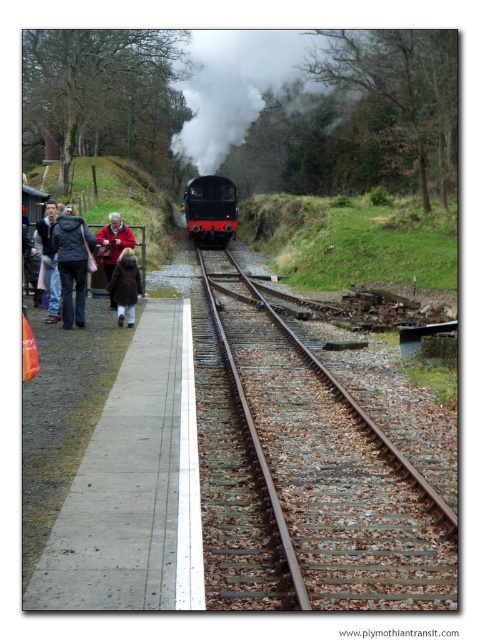
Question: Estimate the real-world distances between objects in this image. Which object is closer to the white smoke at center?

Choices:
 (A) brown woolen coat at left
 (B) dark gray jacket at left
 (C) black glossy train at center

Answer: (C)

Question: Considering the real-world distances, which object is farthest from the black glossy train at center?

Choices:
 (A) brown metal track at center
 (B) red woolen sweater at left
 (C) dark gray jacket at left
 (D) dark brown coat at left

Answer: (C)

Question: Which of the following is the closest to the observer?

Choices:
 (A) dark brown coat at left
 (B) white smoke at center
 (C) brown woolen coat at left

Answer: (A)

Question: Does brown woolen coat at left have a lesser width compared to red woolen sweater at left?

Choices:
 (A) yes
 (B) no

Answer: (A)

Question: Is brown metal track at center closer to the viewer compared to dark brown coat at left?

Choices:
 (A) yes
 (B) no

Answer: (A)

Question: Can you confirm if brown woolen coat at left is smaller than dark brown coat at left?

Choices:
 (A) yes
 (B) no

Answer: (A)